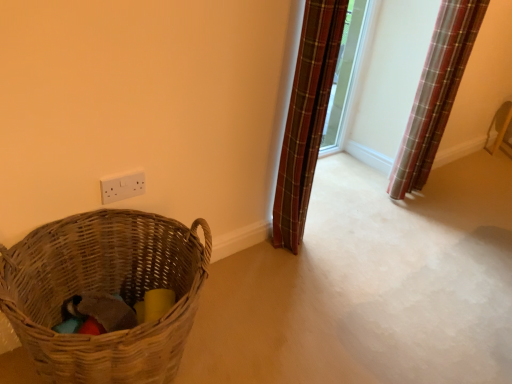
Question: Is woven brown basket at lower left taller than white plastic electric outlet at upper center?

Choices:
 (A) yes
 (B) no

Answer: (A)

Question: Is woven brown basket at lower left outside white plastic electric outlet at upper center?

Choices:
 (A) no
 (B) yes

Answer: (B)

Question: Is white plastic electric outlet at upper center at the back of woven brown basket at lower left?

Choices:
 (A) yes
 (B) no

Answer: (A)

Question: Is woven brown basket at lower left placed right next to white plastic electric outlet at upper center?

Choices:
 (A) yes
 (B) no

Answer: (B)

Question: From the image's perspective, is woven brown basket at lower left beneath white plastic electric outlet at upper center?

Choices:
 (A) yes
 (B) no

Answer: (A)

Question: Is point (431, 153) positioned closer to the camera than point (117, 182)?

Choices:
 (A) closer
 (B) farther

Answer: (B)

Question: From the image's perspective, is plaid fabric curtain at right, the 2th curtain viewed from the left, above or below white plastic electric outlet at upper center?

Choices:
 (A) below
 (B) above

Answer: (B)

Question: In the image, is plaid fabric curtain at right, placed as the first curtain when sorted from right to left, positioned in front of or behind white plastic electric outlet at upper center?

Choices:
 (A) behind
 (B) front

Answer: (A)

Question: Which is correct: plaid fabric curtain at right, placed as the first curtain when sorted from right to left, is inside white plastic electric outlet at upper center, or outside of it?

Choices:
 (A) inside
 (B) outside

Answer: (B)

Question: From a real-world perspective, relative to plaid fabric curtain at upper right, marked as the first curtain in a left-to-right arrangement, is white plastic electric outlet at upper center vertically above or below?

Choices:
 (A) below
 (B) above

Answer: (A)

Question: In terms of height, does white plastic electric outlet at upper center look taller or shorter compared to plaid fabric curtain at upper right, marked as the first curtain in a left-to-right arrangement?

Choices:
 (A) tall
 (B) short

Answer: (B)

Question: Considering the positions of white plastic electric outlet at upper center and plaid fabric curtain at upper right, marked as the first curtain in a left-to-right arrangement, in the image, is white plastic electric outlet at upper center bigger or smaller than plaid fabric curtain at upper right, marked as the first curtain in a left-to-right arrangement,?

Choices:
 (A) small
 (B) big

Answer: (A)

Question: Based on their positions, is white plastic electric outlet at upper center located to the left or right of plaid fabric curtain at upper right, which is the second curtain in right-to-left order?

Choices:
 (A) left
 (B) right

Answer: (A)

Question: From the image's perspective, is woven brown basket at lower left located above or below white plastic electric outlet at upper center?

Choices:
 (A) above
 (B) below

Answer: (B)

Question: Is woven brown basket at lower left taller or shorter than white plastic electric outlet at upper center?

Choices:
 (A) short
 (B) tall

Answer: (B)